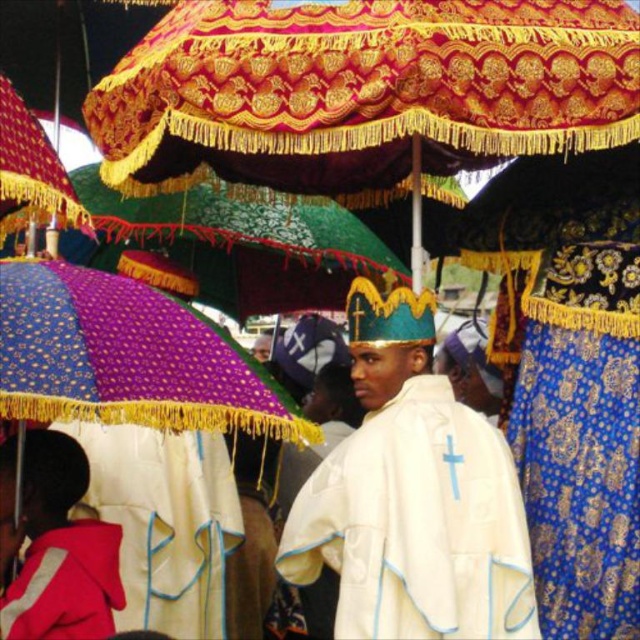
You are a photographer standing at the edge of the crowd. You want to take a photo that includes both the white satin robe at center and the red fleece jacket at lower left. Given that your camera has a maximum zoom range of 10 meters, will you be able to capture both subjects in the same frame without moving closer?

The white satin robe at center and the red fleece jacket at lower left are 13.21 meters apart, which exceeds the camera maximum zoom range of 10 meters. Therefore, you won not be able to capture both subjects in the same frame without moving closer.

Consider the image. You are a photographer trying to capture the priest in the white satin robe at center without any obstructions. Since the red fleece jacket at lower left is in the way, can you move the jacket to get a clear shot?

The white satin robe at center is positioned over the red fleece jacket at lower left, meaning the jacket is behind the robe. Therefore, moving the jacket would not be necessary as it is already obscured from view by the robe.

You are standing at the camera position observing the scene. There is a point marked at coordinates point (410, 536). Can you reach that point without moving your position? Explain your reasoning.

The point (410, 536) is 161.33 feet away from the camera. Since you are at the camera position, you cannot physically reach a point that far away without moving.